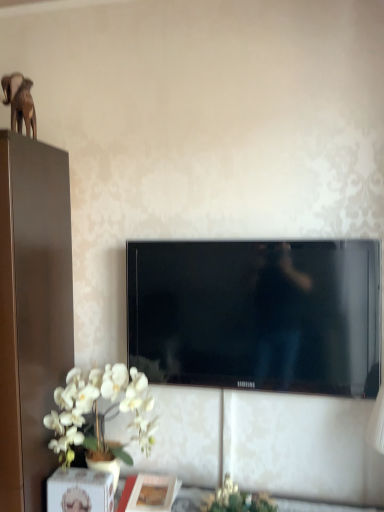
Question: Can you confirm if black glossy tv at center is wider than white matte orchid at lower left?

Choices:
 (A) yes
 (B) no

Answer: (B)

Question: Does black glossy tv at center touch white matte orchid at lower left?

Choices:
 (A) no
 (B) yes

Answer: (A)

Question: From a real-world perspective, is black glossy tv at center physically below white matte orchid at lower left?

Choices:
 (A) no
 (B) yes

Answer: (A)

Question: From a real-world perspective, is black glossy tv at center on white matte orchid at lower left?

Choices:
 (A) no
 (B) yes

Answer: (B)

Question: Is black glossy tv at center positioned with its back to white matte orchid at lower left?

Choices:
 (A) no
 (B) yes

Answer: (A)

Question: From the image's perspective, relative to white matte orchid at lower left, is matte white picture frame at lower center above or below?

Choices:
 (A) below
 (B) above

Answer: (A)

Question: Does point (135, 498) appear closer or farther from the camera than point (122, 448)?

Choices:
 (A) closer
 (B) farther

Answer: (A)

Question: Relative to white matte orchid at lower left, is matte white picture frame at lower center in front or behind?

Choices:
 (A) behind
 (B) front

Answer: (A)

Question: From a real-world perspective, is matte white picture frame at lower center physically located above or below white matte orchid at lower left?

Choices:
 (A) above
 (B) below

Answer: (B)

Question: From a real-world perspective, is green leafy plant at lower center above or below black glossy tv at center?

Choices:
 (A) above
 (B) below

Answer: (B)

Question: In the image, is green leafy plant at lower center positioned in front of or behind black glossy tv at center?

Choices:
 (A) behind
 (B) front

Answer: (B)

Question: Is green leafy plant at lower center bigger or smaller than black glossy tv at center?

Choices:
 (A) small
 (B) big

Answer: (A)

Question: Would you say green leafy plant at lower center is to the left or to the right of black glossy tv at center in the picture?

Choices:
 (A) right
 (B) left

Answer: (B)

Question: Do you think green leafy plant at lower center is within brown matte elephant at upper left, or outside of it?

Choices:
 (A) outside
 (B) inside

Answer: (A)

Question: Is point (259, 500) closer or farther from the camera than point (21, 79)?

Choices:
 (A) farther
 (B) closer

Answer: (B)